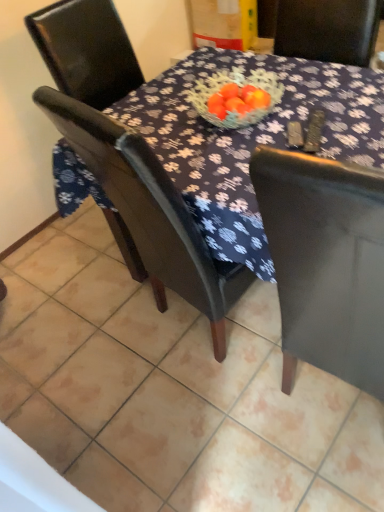
Question: From the image's perspective, is matte black chair at center located above or below matte black chair at left, the 2th chair in the bottom-to-top sequence?

Choices:
 (A) below
 (B) above

Answer: (A)

Question: Is matte black chair at center inside the boundaries of matte black chair at left, marked as the first chair in a top-to-bottom arrangement, or outside?

Choices:
 (A) inside
 (B) outside

Answer: (B)

Question: Estimate the real-world distances between objects in this image. Which object is farther from the matte black chair at left, marked as the first chair in a top-to-bottom arrangement?

Choices:
 (A) matte black chair at center
 (B) matte black chair at center, marked as the 1th chair in a bottom-to-top arrangement

Answer: (A)

Question: Which of these objects is positioned farthest from the matte black chair at center?

Choices:
 (A) matte black chair at left, the 2th chair in the bottom-to-top sequence
 (B) matte black chair at center, marked as the 1th chair in a bottom-to-top arrangement

Answer: (A)